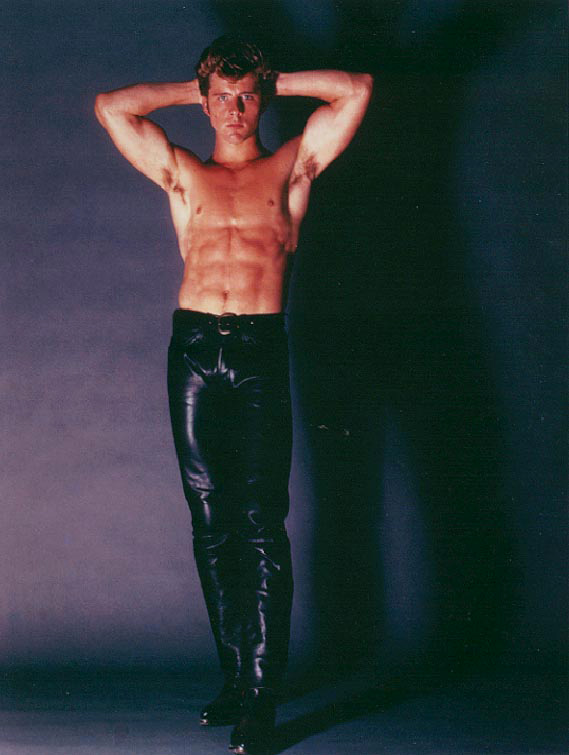
Locate an element on the screen. Image resolution: width=569 pixels, height=755 pixels. studio lighting highlight is located at coordinates (193, 380), (189, 447), (203, 488), (259, 657), (263, 578), (237, 380), (221, 346).